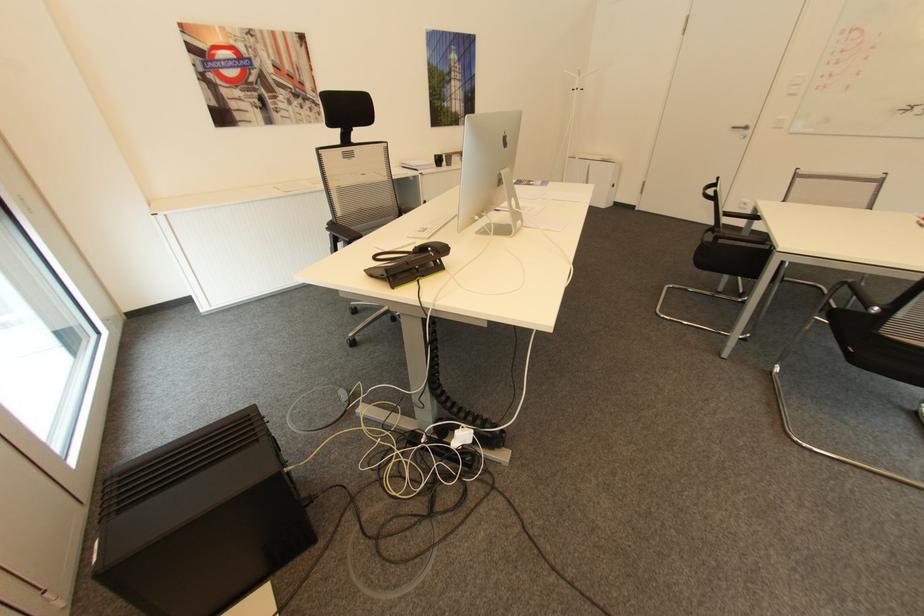
You are a GUI agent. You are given a task and a screenshot of the screen. Output one action in this format:
    pyautogui.click(x=<x>, y=<y>)
    Task: Click on the small black cup
    The image size is (924, 616).
    Given the screenshot: What is the action you would take?
    pyautogui.click(x=438, y=160)